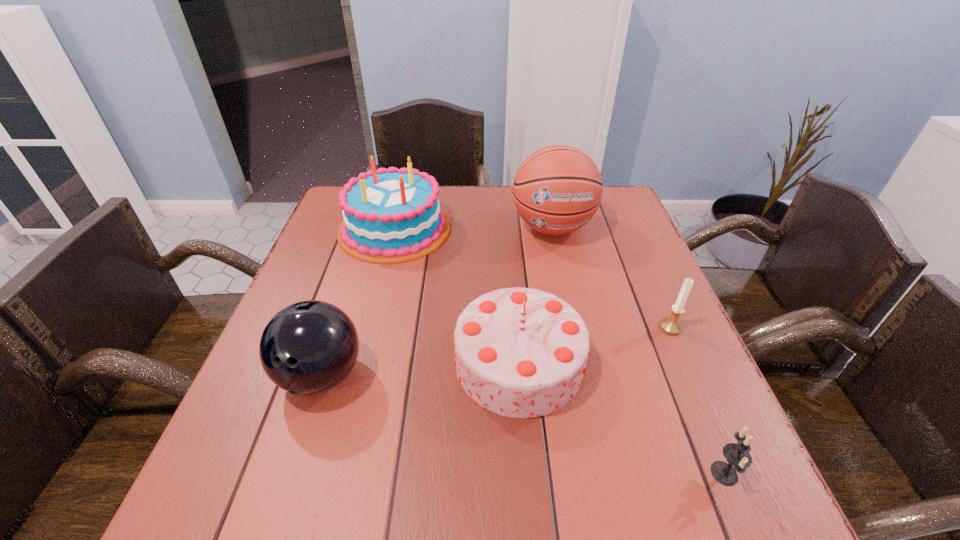
The image size is (960, 540). In order to click on object that is at the far left corner in this screenshot , I will do `click(391, 215)`.

You are a GUI agent. You are given a task and a screenshot of the screen. Output one action in this format:
    pyautogui.click(x=<x>, y=<y>)
    Task: Click on the object that is at the far right corner
    Image resolution: width=960 pixels, height=540 pixels.
    Given the screenshot: What is the action you would take?
    pyautogui.click(x=557, y=190)

Locate an element on the screen. Image resolution: width=960 pixels, height=540 pixels. object that is at the near right corner is located at coordinates (737, 455).

Identify the location of free space at the far edge of the desktop. (503, 212).

Locate an element on the screen. The height and width of the screenshot is (540, 960). free location at the near edge is located at coordinates (525, 476).

Find the location of `vacant space at the left edge`. vacant space at the left edge is located at coordinates (315, 399).

The width and height of the screenshot is (960, 540). In order to click on vacant space at the far right corner of the desktop in this screenshot , I will do `click(603, 207)`.

In order to click on vacant region between the fifth tallest object and the right birthday cake in this screenshot , I will do `click(595, 345)`.

Find the location of a particular element. This screenshot has width=960, height=540. empty location between the nearer birthday cake and the left birthday cake is located at coordinates (457, 295).

Locate an element on the screen. The image size is (960, 540). vacant point located between the farther birthday cake and the bowling ball is located at coordinates (358, 302).